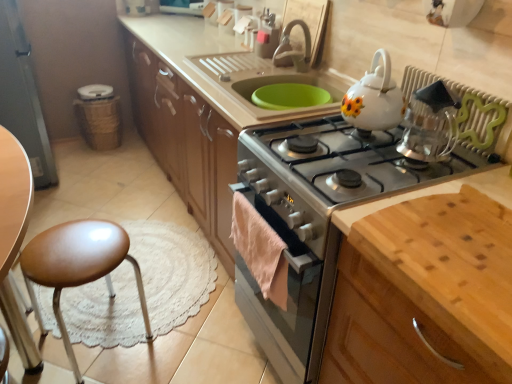
I want to click on free space in front of silver metallic faucet at upper center, so click(285, 73).